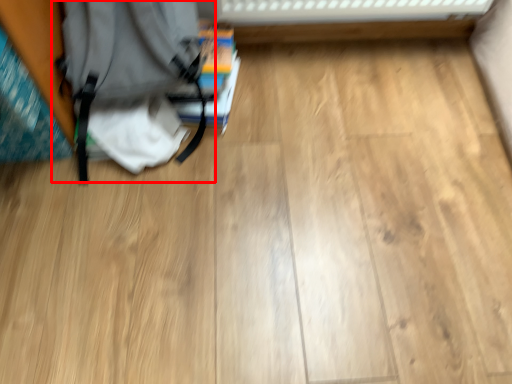
Question: Where is backpack (annotated by the red box) located in relation to book in the image?

Choices:
 (A) left
 (B) right

Answer: (A)